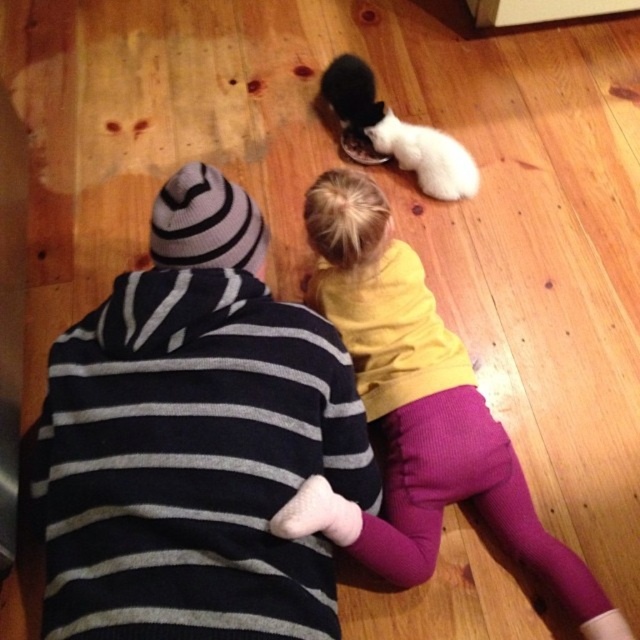
You are a photographer trying to capture a clear photo of the white fluffy cat at center without the yellow fleece shirt at center blocking the view. Based on the scene, can you adjust your position to achieve this?

The yellow fleece shirt at center is in front of the white fluffy cat at center, so moving your camera position slightly behind the yellow fleece shirt at center would allow you to see the white fluffy cat at center without obstruction.

You are a photographer trying to capture a closeup of the yellow fleece shirt at center and the white fluffy cat at center in the image. Given that your camera can only focus on objects within 50 centimeters of each other, will you be able to get a clear shot of both subjects?

The yellow fleece shirt at center and the white fluffy cat at center are 50.28 centimeters apart, which is slightly more than the 50 centimeter limit. Therefore, the camera cannot focus on both subjects simultaneously.

You are a photographer trying to capture both the white fluffy cat at center and the black fur cat at center in a single frame. Based on their positions and sizes, which cat do you think will appear larger in the photo?

The white fluffy cat at center might appear larger in the photo since it is wider than the black fur cat at center.